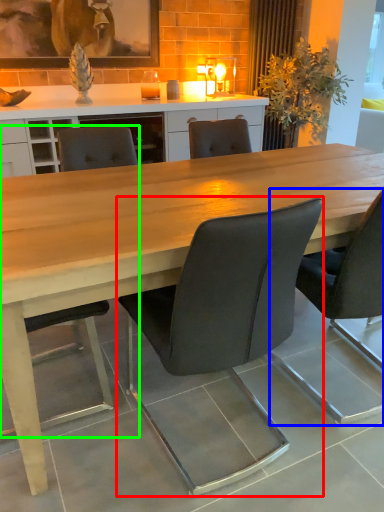
Question: Which object is the farthest from chair (highlighted by a red box)? Choose among these: chair (highlighted by a blue box) or chair (highlighted by a green box).

Choices:
 (A) chair
 (B) chair

Answer: (B)